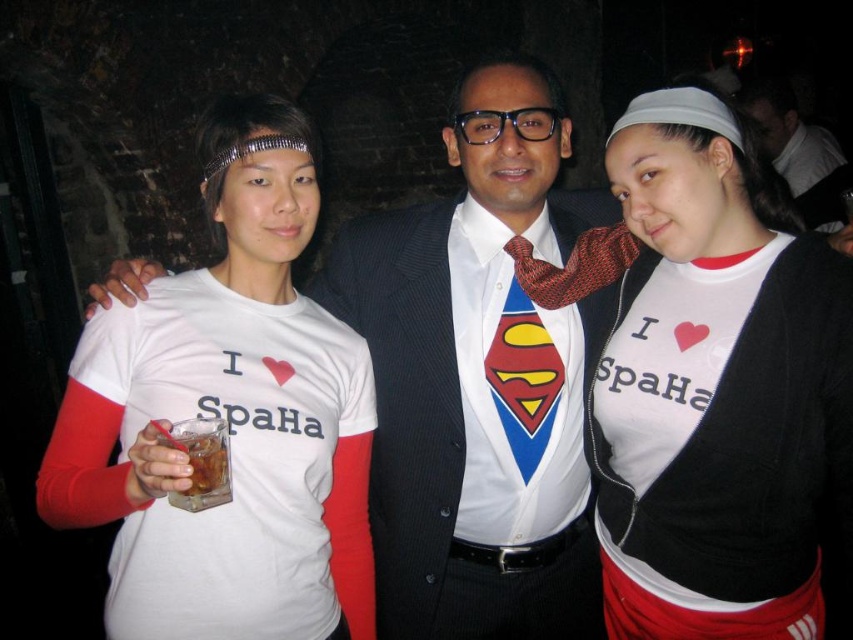
In the scene shown: Between red textured tie at center and translucent glass drink at lower left, which one appears on the left side from the viewer's perspective?

translucent glass drink at lower left is more to the left.

Does red textured tie at center appear on the left side of translucent glass drink at lower left?

Incorrect, red textured tie at center is not on the left side of translucent glass drink at lower left.

Does point (556, 301) lie in front of point (201, 429)?

No, it is behind (201, 429).

I want to click on red textured tie at center, so click(573, 266).

Which is more to the right, white matte t-shirt at center or white fabric t-shirt at left?

From the viewer's perspective, white matte t-shirt at center appears more on the right side.

Between white matte t-shirt at center and white fabric t-shirt at left, which one appears on the left side from the viewer's perspective?

white fabric t-shirt at left

What do you see at coordinates (717, 392) in the screenshot?
I see `white matte t-shirt at center` at bounding box center [717, 392].

Find the location of `white matte t-shirt at center`. white matte t-shirt at center is located at coordinates (717, 392).

Who is lower down, white fabric t-shirt at left or matte black suit at center?

white fabric t-shirt at left is lower down.

Does point (186, 317) come farther from viewer compared to point (770, 154)?

No, (186, 317) is closer to viewer.

The width and height of the screenshot is (853, 640). I want to click on white fabric t-shirt at left, so click(x=231, y=465).